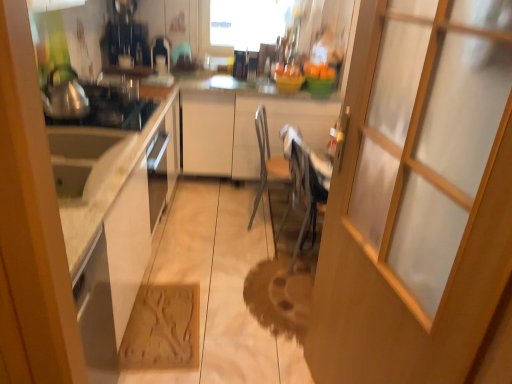
Question: Is the position of transparent glass window at upper center more distant than that of brown textured mat at lower center?

Choices:
 (A) yes
 (B) no

Answer: (A)

Question: Can you confirm if transparent glass window at upper center is positioned to the right of brown textured mat at lower center?

Choices:
 (A) no
 (B) yes

Answer: (B)

Question: Is transparent glass window at upper center oriented towards brown textured mat at lower center?

Choices:
 (A) no
 (B) yes

Answer: (A)

Question: Does transparent glass window at upper center have a larger size compared to brown textured mat at lower center?

Choices:
 (A) no
 (B) yes

Answer: (B)

Question: Is the depth of transparent glass window at upper center less than that of brown textured mat at lower center?

Choices:
 (A) no
 (B) yes

Answer: (A)

Question: From a real-world perspective, does transparent glass window at upper center sit lower than brown textured mat at lower center?

Choices:
 (A) no
 (B) yes

Answer: (A)

Question: From the image's perspective, is transparent glass door at center beneath transparent glass window at upper center?

Choices:
 (A) no
 (B) yes

Answer: (B)

Question: Is transparent glass door at center positioned with its back to transparent glass window at upper center?

Choices:
 (A) yes
 (B) no

Answer: (B)

Question: From the image's perspective, would you say transparent glass door at center is positioned over transparent glass window at upper center?

Choices:
 (A) no
 (B) yes

Answer: (A)

Question: Is the position of transparent glass door at center more distant than that of transparent glass window at upper center?

Choices:
 (A) yes
 (B) no

Answer: (B)

Question: Would you say transparent glass door at center is outside transparent glass window at upper center?

Choices:
 (A) yes
 (B) no

Answer: (A)

Question: Considering the relative positions of transparent glass door at center and transparent glass window at upper center in the image provided, is transparent glass door at center to the left of transparent glass window at upper center from the viewer's perspective?

Choices:
 (A) no
 (B) yes

Answer: (A)

Question: Can you confirm if brown textured mat at lower center is positioned to the right of brushed metal tea pot at left?

Choices:
 (A) yes
 (B) no

Answer: (A)